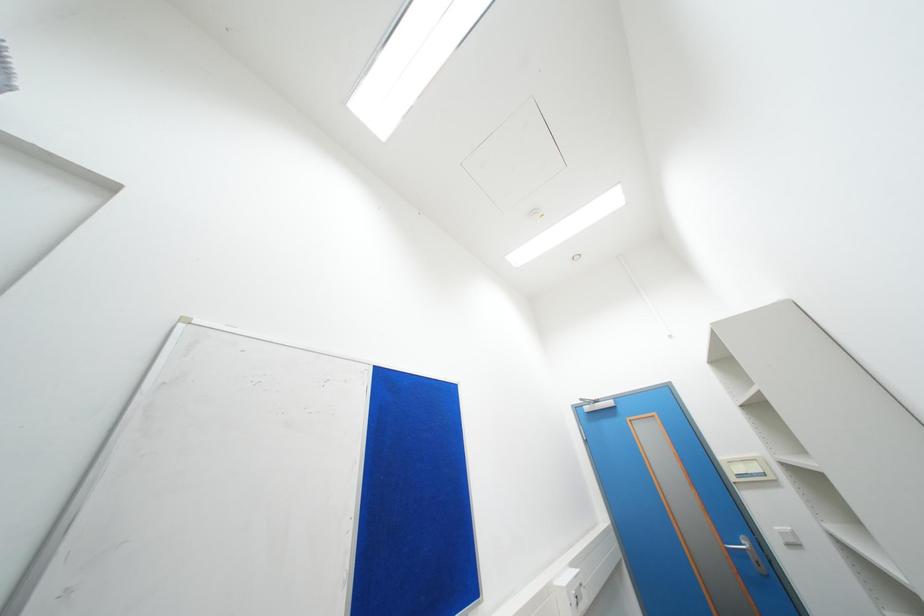
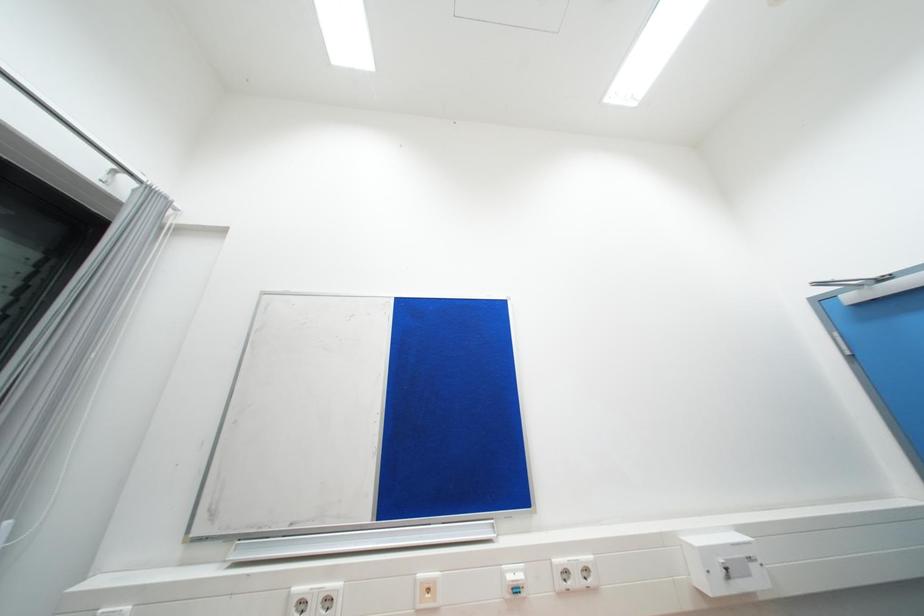
Question: Based on the continuous images, in which direction is the camera rotating? Reply with the corresponding letter.

Choices:
 (A) Left
 (B) Right
 (C) Up
 (D) Down

Answer: (A)